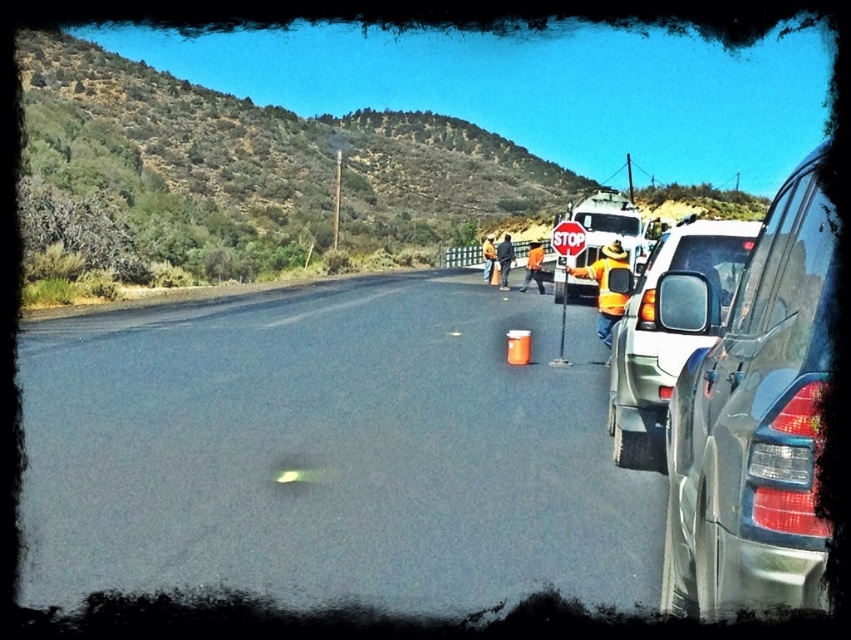
Is black asphalt road at center in front of satin silver sedan at right?

No, it is not.

Does black asphalt road at center have a lesser width compared to satin silver sedan at right?

Incorrect, black asphalt road at center's width is not less than satin silver sedan at right's.

Measure the distance between black asphalt road at center and camera.

black asphalt road at center is 5.37 meters from camera.

This screenshot has height=640, width=851. I want to click on black asphalt road at center, so click(x=329, y=452).

Who is more distant from viewer, (x=126, y=483) or (x=615, y=397)?

The point (x=615, y=397) is more distant.

Who is more forward, (363, 346) or (717, 292)?

Point (717, 292)

Does point (193, 556) lie in front of point (660, 252)?

Yes.

Where is `black asphalt road at center`? black asphalt road at center is located at coordinates (329, 452).

In the scene shown: Can you confirm if satin silver sedan at right is thinner than matte black suv at right?

Indeed, satin silver sedan at right has a lesser width compared to matte black suv at right.

Between satin silver sedan at right and matte black suv at right, which one is positioned lower?

satin silver sedan at right is below.

Does point (712, 593) come farther from viewer compared to point (721, 253)?

No, (712, 593) is closer to viewer.

Identify the location of satin silver sedan at right. (757, 426).